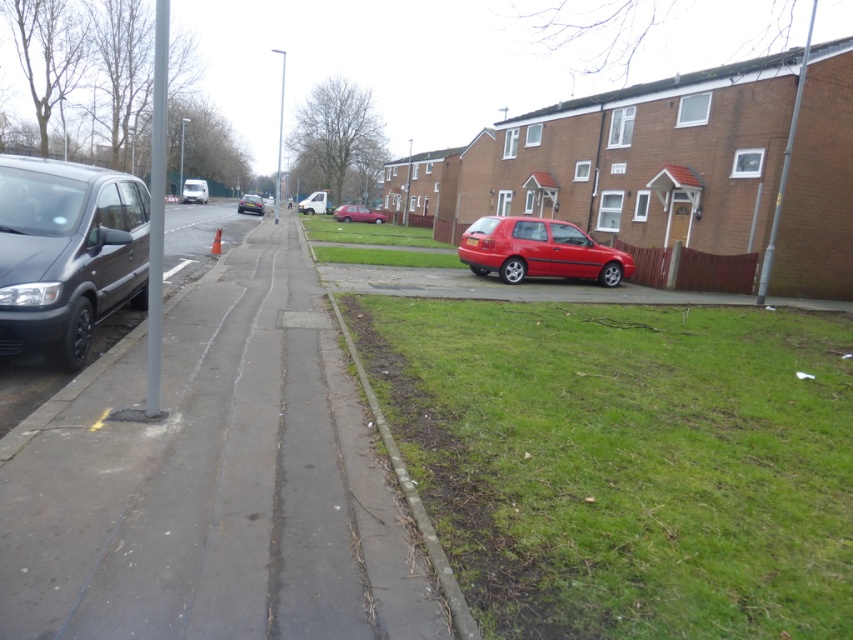
Question: Does concrete sidewalk at center appear under matte black van at left?

Choices:
 (A) yes
 (B) no

Answer: (A)

Question: Is concrete sidewalk at center to the right of white matte van at center from the viewer's perspective?

Choices:
 (A) yes
 (B) no

Answer: (A)

Question: Which of the following is the closest to the observer?

Choices:
 (A) green grass at lower right
 (B) green grass at center
 (C) white matte van at center
 (D) shiny black car at center

Answer: (A)

Question: Does white matte van at center have a larger size compared to shiny black car at center?

Choices:
 (A) yes
 (B) no

Answer: (B)

Question: Which object is closer to the camera taking this photo?

Choices:
 (A) shiny black car at center
 (B) concrete sidewalk at center

Answer: (B)

Question: Considering the real-world distances, which object is farthest from the shiny black car at center?

Choices:
 (A) white matte van at center
 (B) matte red hatchback at center
 (C) green grass at center

Answer: (C)